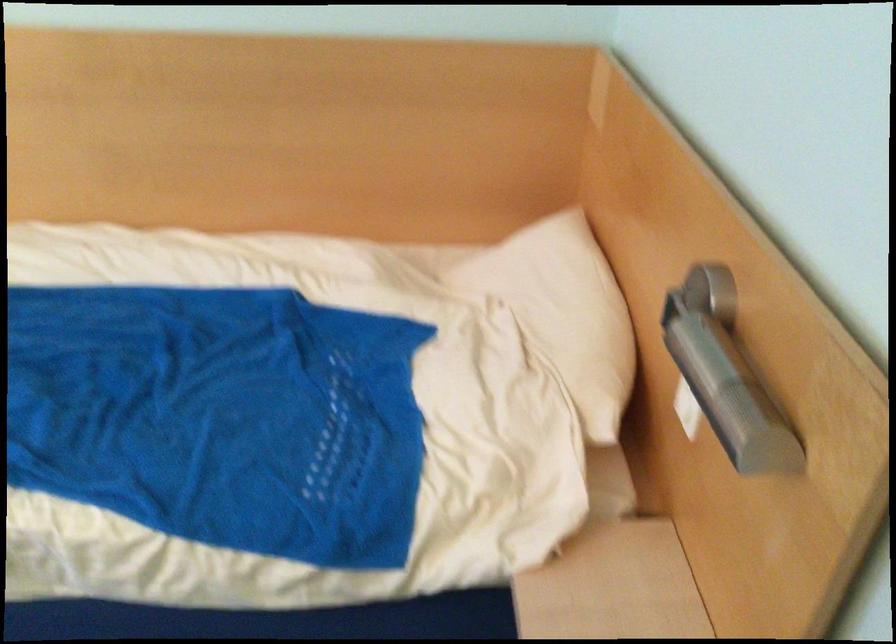
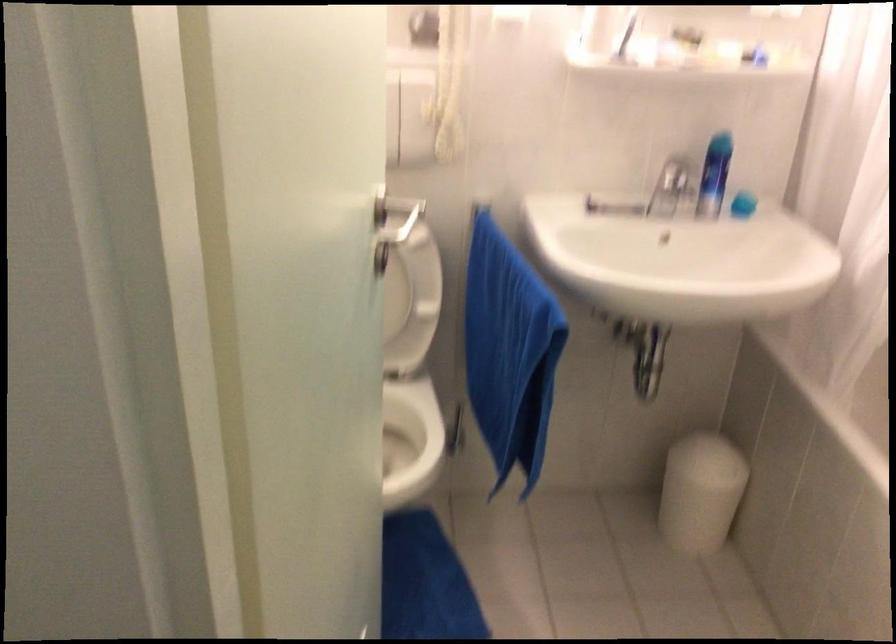
Question: How did the camera likely rotate?

Choices:
 (A) Left
 (B) Right
 (C) Up
 (D) Down

Answer: (C)